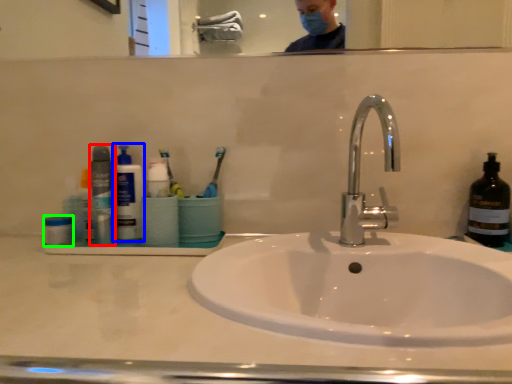
Question: Which object is positioned farthest from bottle (highlighted by a red box)? Select from cleaning product (highlighted by a blue box) and mouthwash (highlighted by a green box).

Choices:
 (A) cleaning product
 (B) mouthwash

Answer: (B)